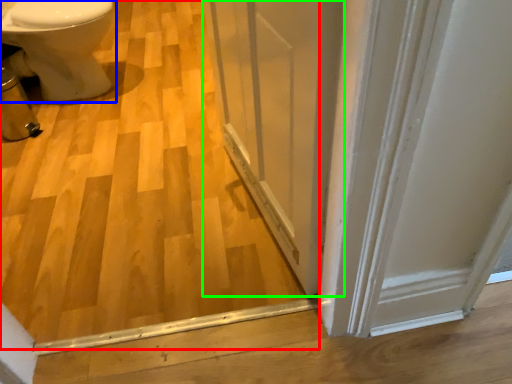
Question: Which is farther away from plywood (highlighted by a red box)? bidet (highlighted by a blue box) or screen door (highlighted by a green box)?

Choices:
 (A) bidet
 (B) screen door

Answer: (A)